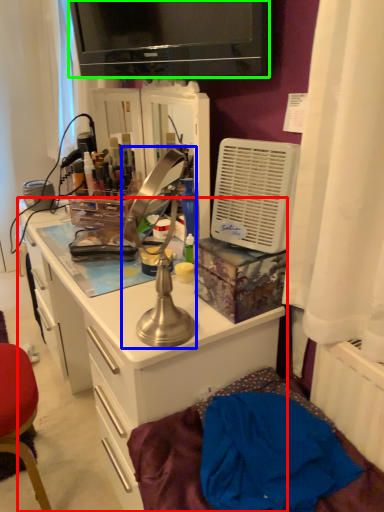
Question: Considering the real-world distances, which object is closest to cabinetry (highlighted by a red box)? table lamp (highlighted by a blue box) or television (highlighted by a green box).

Choices:
 (A) table lamp
 (B) television

Answer: (A)